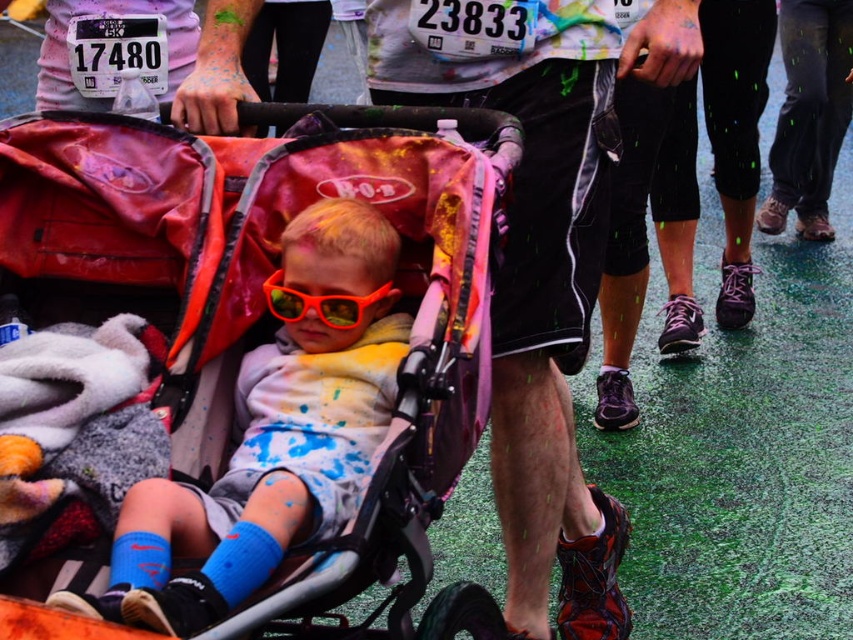
Who is more forward, (32, 433) or (519, 268)?

Point (32, 433) is in front.

Measure the distance between matte pink stroller at center and camera.

matte pink stroller at center is 5.57 feet from camera.

Where is `matte pink stroller at center`? matte pink stroller at center is located at coordinates (235, 339).

Does matte pink stroller at center have a lesser height compared to shiny orange plastic goggles at center?

No, matte pink stroller at center is not shorter than shiny orange plastic goggles at center.

Who is positioned more to the right, matte pink stroller at center or shiny orange plastic goggles at center?

shiny orange plastic goggles at center is more to the right.

Is point (329, 420) behind point (383, 289)?

No, it is not.

This screenshot has height=640, width=853. I want to click on matte pink stroller at center, so click(235, 339).

Does matte black shorts at center come behind shiny orange plastic goggles at center?

Yes, matte black shorts at center is behind shiny orange plastic goggles at center.

Is matte black shorts at center thinner than shiny orange plastic goggles at center?

In fact, matte black shorts at center might be wider than shiny orange plastic goggles at center.

Image resolution: width=853 pixels, height=640 pixels. I want to click on matte black shorts at center, so click(531, 269).

I want to click on matte black shorts at center, so click(531, 269).